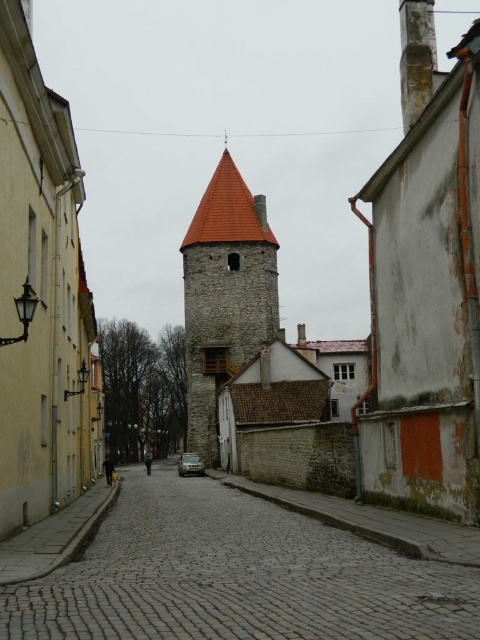
You are a tourist standing at the entrance of the cobblestone street at center and the smooth stone bell tower at center. You want to take a photo that includes both objects in the frame. Which object should you focus on to ensure both are visible?

The cobblestone street at center has a smaller size compared to the smooth stone bell tower at center. To include both in the frame, focus on the smooth stone bell tower at center since it is larger and will occupy more space, allowing the smaller cobblestone street at center to be captured alongside it.

You are a delivery cart driver trying to navigate through the narrow cobblestone street at center and the smooth stone bell tower at center. Can your cart pass through the space between them?

The cobblestone street at center is wider than the smooth stone bell tower at center, so yes, the cart can pass through the space between them as the street is wide enough.

You are a tourist standing at the entrance of the cobblestone street at center. You want to take a photo of the smooth stone bell tower at center. Which direction should you face to ensure the bell tower is fully visible in your photo?

Since the cobblestone street at center is in front of the smooth stone bell tower at center, you should face backward to capture the bell tower in your photo.